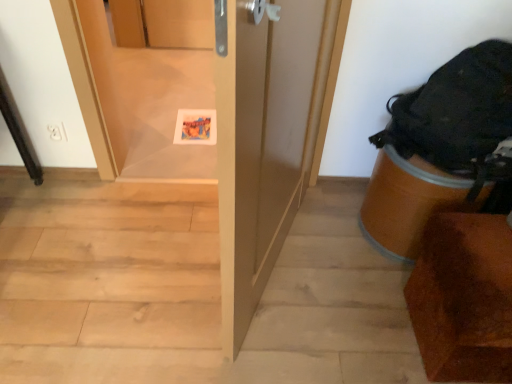
The height and width of the screenshot is (384, 512). Find the location of `vacant area on top of brown wood chair at lower right (from a real-world perspective)`. vacant area on top of brown wood chair at lower right (from a real-world perspective) is located at coordinates (484, 249).